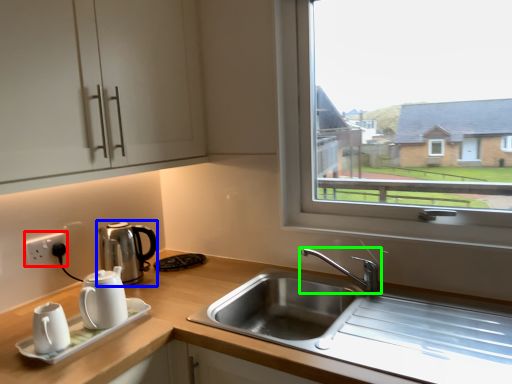
Question: Which object is the farthest from electric outlet (highlighted by a red box)? Choose among these: coffeepot (highlighted by a blue box) or tap (highlighted by a green box).

Choices:
 (A) coffeepot
 (B) tap

Answer: (B)